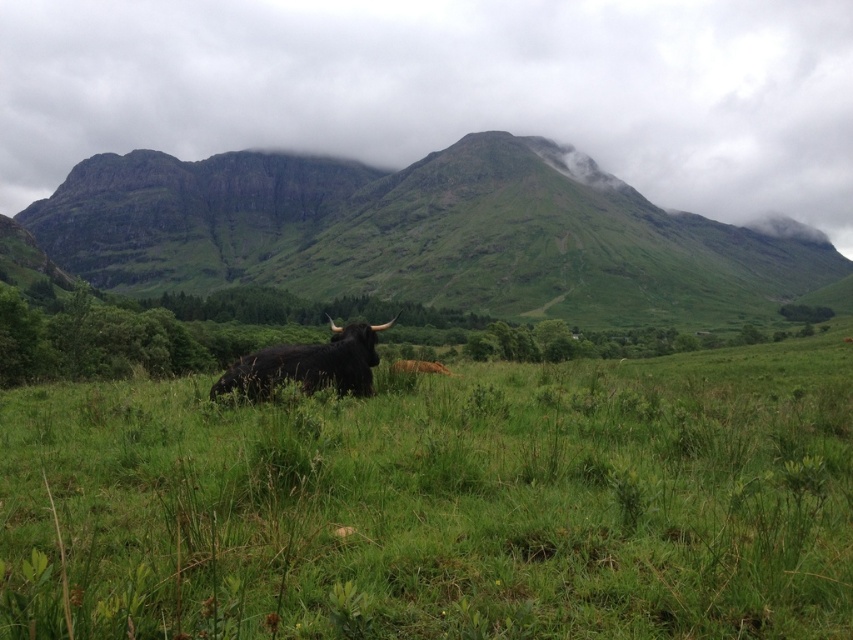
Describe the element at coordinates (440, 502) in the screenshot. This screenshot has width=853, height=640. I see `green grassy field at center` at that location.

Between point (770, 452) and point (335, 384), which one is positioned behind?

Point (335, 384)

Does point (570, 424) come in front of point (270, 349)?

Yes.

Where is `green grassy field at center`? green grassy field at center is located at coordinates (440, 502).

Does green grassy field at center have a lesser height compared to green grassy mountain at upper center?

Correct, green grassy field at center is not as tall as green grassy mountain at upper center.

Is point (403, 502) behind point (492, 291)?

No.

In order to click on green grassy field at center in this screenshot , I will do `click(440, 502)`.

Does green grassy mountain at upper center have a greater height compared to black furry bull at center?

Indeed, green grassy mountain at upper center has a greater height compared to black furry bull at center.

Which of these two, green grassy mountain at upper center or black furry bull at center, stands shorter?

With less height is black furry bull at center.

This screenshot has width=853, height=640. In order to click on green grassy mountain at upper center in this screenshot , I will do (424, 234).